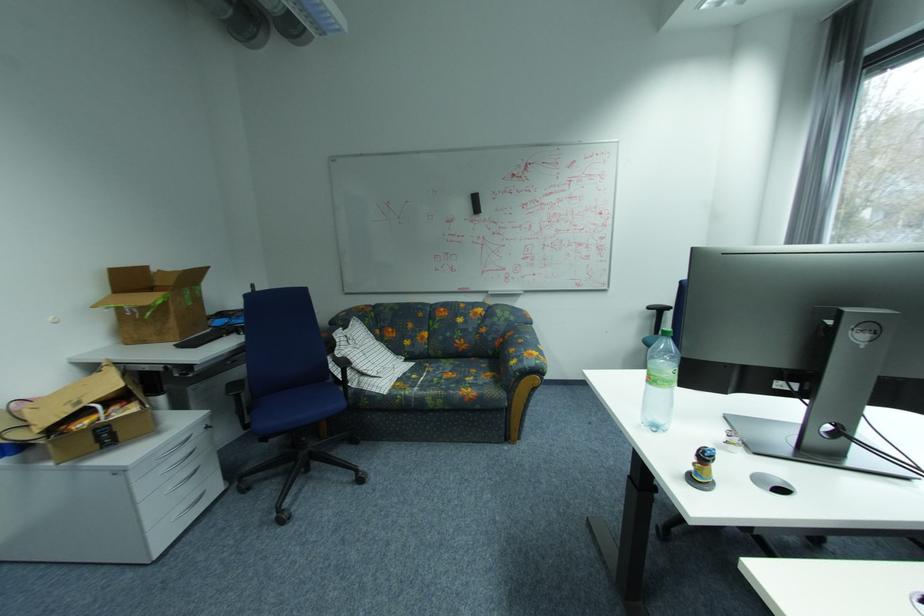
Where is `floral sofa surface`? The width and height of the screenshot is (924, 616). floral sofa surface is located at coordinates (453, 384).